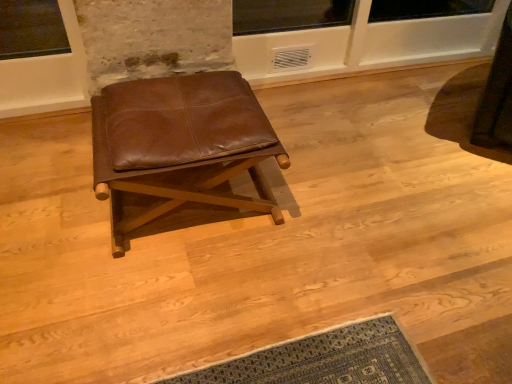
Image resolution: width=512 pixels, height=384 pixels. I want to click on free spot in front of brown leather stool at center, so click(x=172, y=304).